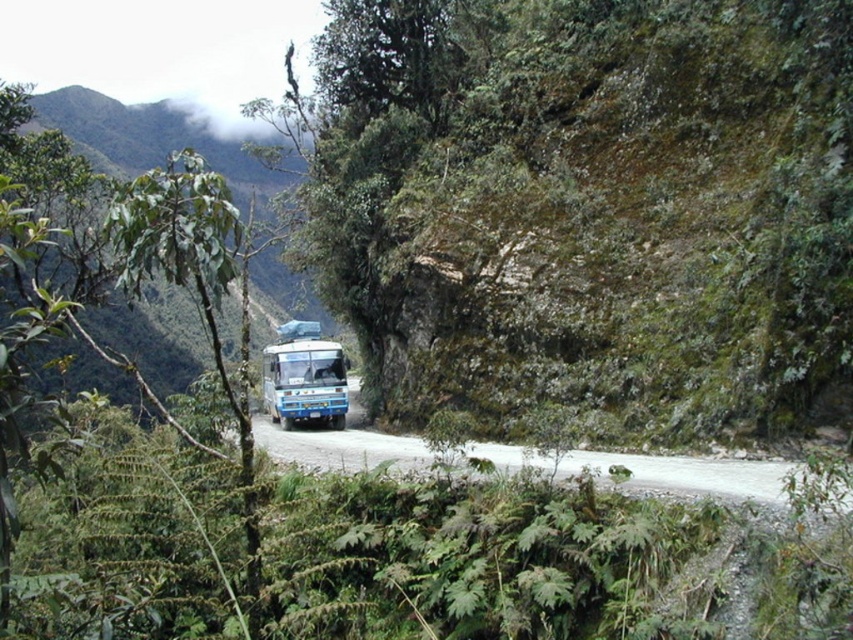
Which is below, green leafy tree at center or blue matte bus at center?

Positioned lower is blue matte bus at center.

Between green leafy tree at center and blue matte bus at center, which one appears on the right side from the viewer's perspective?

Positioned to the right is green leafy tree at center.

Find the location of a particular element. The width and height of the screenshot is (853, 640). green leafy tree at center is located at coordinates (589, 205).

Can you confirm if green leafy tree at center is thinner than gray gravel road at center?

Incorrect, green leafy tree at center's width is not less than gray gravel road at center's.

Which is more to the right, green leafy tree at center or gray gravel road at center?

Positioned to the right is green leafy tree at center.

Locate an element on the screen. The image size is (853, 640). green leafy tree at center is located at coordinates (589, 205).

You are a GUI agent. You are given a task and a screenshot of the screen. Output one action in this format:
    pyautogui.click(x=<x>, y=<y>)
    Task: Click on the green leafy tree at center
    This screenshot has width=853, height=640.
    Given the screenshot: What is the action you would take?
    pyautogui.click(x=589, y=205)

Does green leafy mountain at center appear under blue matte bus at center?

No, green leafy mountain at center is not below blue matte bus at center.

From the picture: Does green leafy mountain at center come in front of blue matte bus at center?

No, it is behind blue matte bus at center.

Is point (231, 321) positioned behind point (340, 369)?

Yes, it is behind point (340, 369).

You are a GUI agent. You are given a task and a screenshot of the screen. Output one action in this format:
    pyautogui.click(x=<x>, y=<y>)
    Task: Click on the green leafy mountain at center
    This screenshot has width=853, height=640.
    Given the screenshot: What is the action you would take?
    pyautogui.click(x=51, y=157)